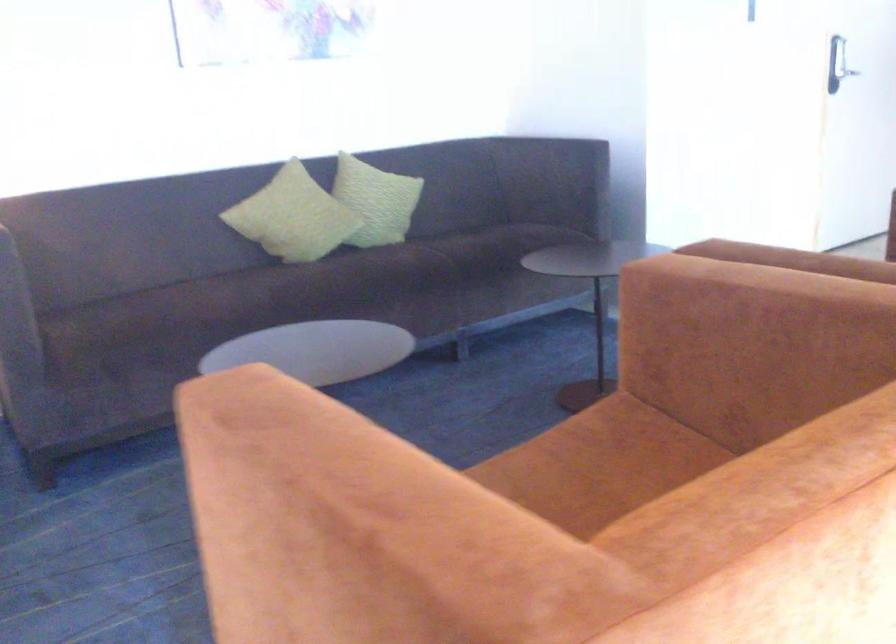
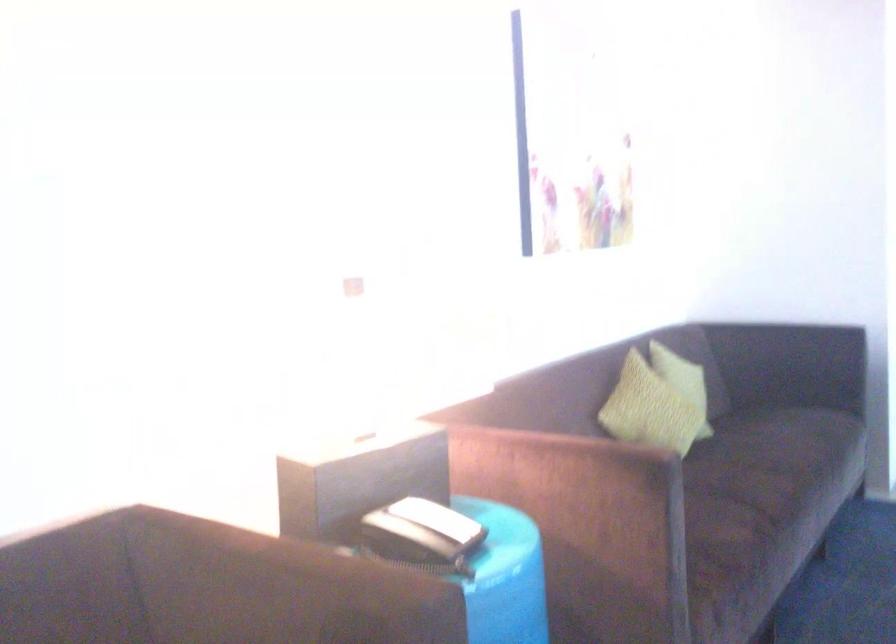
Find the pixel in the second image that matches point (263, 301) in the first image.

(768, 489)